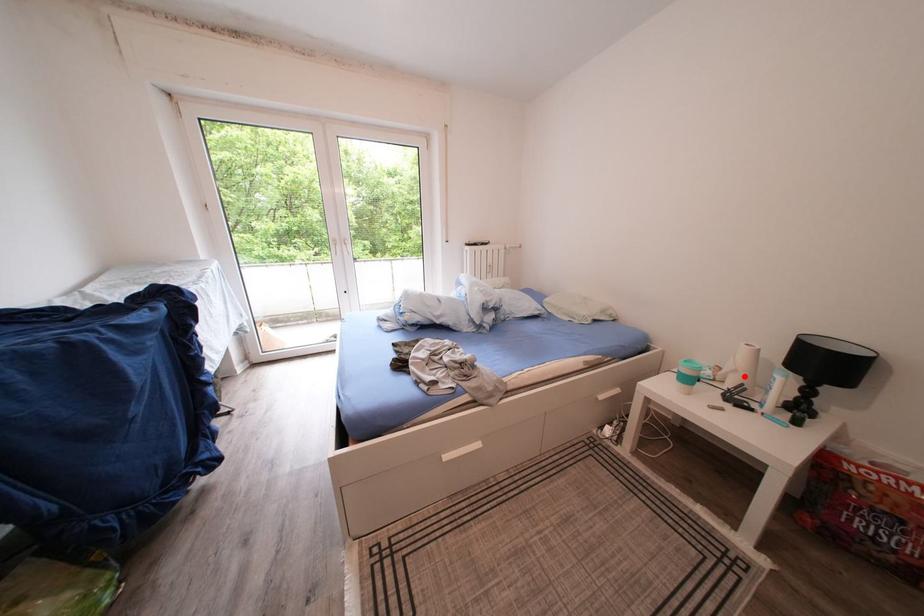
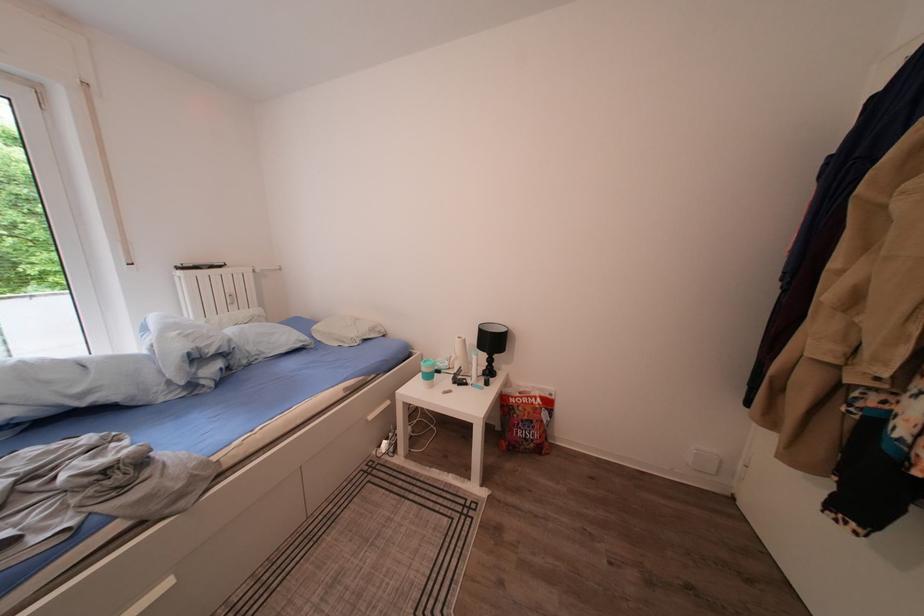
Question: I am providing you with two images of the same scene from different viewpoints. In image1, a red point is highlighted. Considering the same 3D point in image2, which of the following is correct?

Choices:
 (A) It is closer
 (B) It is farther

Answer: (B)